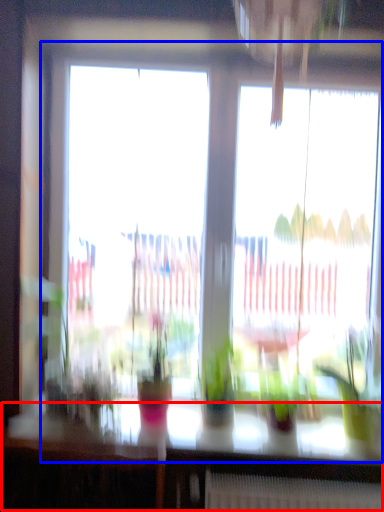
Question: Among these objects, which one is farthest to the camera, table (highlighted by a red box) or window (highlighted by a blue box)?

Choices:
 (A) table
 (B) window

Answer: (B)